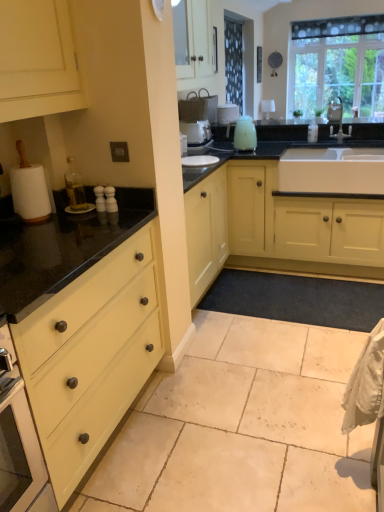
Question: Does beige tile floor at lower center have a lesser width compared to satin nickel faucet at upper right?

Choices:
 (A) no
 (B) yes

Answer: (A)

Question: Is beige tile floor at lower center turned away from satin nickel faucet at upper right?

Choices:
 (A) yes
 (B) no

Answer: (B)

Question: Can you confirm if beige tile floor at lower center is shorter than satin nickel faucet at upper right?

Choices:
 (A) yes
 (B) no

Answer: (A)

Question: From a real-world perspective, does beige tile floor at lower center stand above satin nickel faucet at upper right?

Choices:
 (A) no
 (B) yes

Answer: (A)

Question: Is beige tile floor at lower center not near satin nickel faucet at upper right?

Choices:
 (A) yes
 (B) no

Answer: (A)

Question: Looking at the image, does matte yellow cabinet at center seem bigger or smaller compared to satin nickel faucet at upper right?

Choices:
 (A) big
 (B) small

Answer: (A)

Question: From their relative heights in the image, would you say matte yellow cabinet at center is taller or shorter than satin nickel faucet at upper right?

Choices:
 (A) short
 (B) tall

Answer: (B)

Question: Relative to satin nickel faucet at upper right, is matte yellow cabinet at center in front or behind?

Choices:
 (A) behind
 (B) front

Answer: (B)

Question: Considering the positions of matte yellow cabinet at center and satin nickel faucet at upper right in the image, is matte yellow cabinet at center wider or thinner than satin nickel faucet at upper right?

Choices:
 (A) thin
 (B) wide

Answer: (B)

Question: From a real-world perspective, relative to white ceramic sink at center, is transparent glass window at upper right vertically above or below?

Choices:
 (A) above
 (B) below

Answer: (A)

Question: In the image, is transparent glass window at upper right on the left side or the right side of white ceramic sink at center?

Choices:
 (A) right
 (B) left

Answer: (A)

Question: Considering the positions of transparent glass window at upper right and white ceramic sink at center in the image, is transparent glass window at upper right taller or shorter than white ceramic sink at center?

Choices:
 (A) tall
 (B) short

Answer: (A)

Question: Which is correct: transparent glass window at upper right is inside white ceramic sink at center, or outside of it?

Choices:
 (A) outside
 (B) inside

Answer: (A)

Question: Is matte yellow drawer at left taller or shorter than matte yellow cabinet at center?

Choices:
 (A) tall
 (B) short

Answer: (B)

Question: Visually, is matte yellow drawer at left positioned to the left or to the right of matte yellow cabinet at center?

Choices:
 (A) right
 (B) left

Answer: (B)